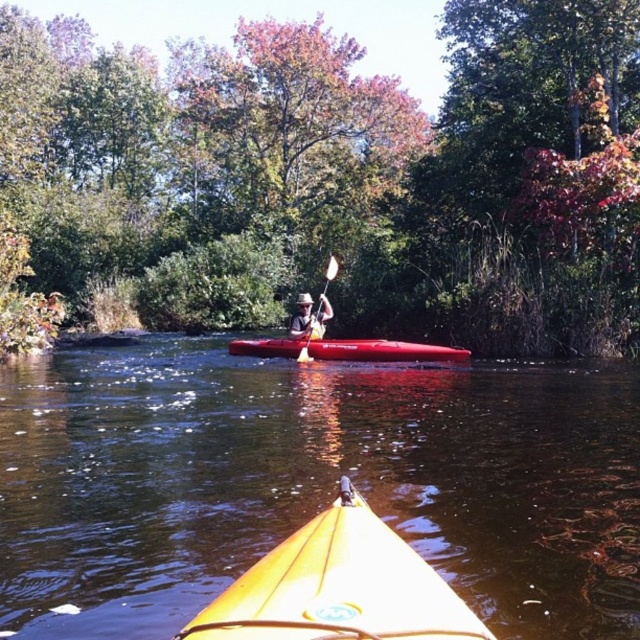
Question: Which point appears farthest from the camera in this image?

Choices:
 (A) (298, 360)
 (B) (307, 301)

Answer: (A)

Question: Based on their relative distances, which object is farther from the white wood paddle at center?

Choices:
 (A) matte brown kayak at center
 (B) shiny red canoe at center
 (C) yellow plastic kayak at center
 (D) yellow matte kayak at center

Answer: (D)

Question: Is yellow plastic kayak at center bigger than white wood paddle at center?

Choices:
 (A) yes
 (B) no

Answer: (A)

Question: Can you confirm if shiny red canoe at center is smaller than matte brown kayak at center?

Choices:
 (A) yes
 (B) no

Answer: (B)

Question: Which point appears closest to the camera in this image?

Choices:
 (A) (387, 557)
 (B) (225, 550)
 (C) (305, 353)
 (D) (307, 330)

Answer: (A)

Question: Does shiny red canoe at center appear on the right side of white wood paddle at center?

Choices:
 (A) yes
 (B) no

Answer: (B)